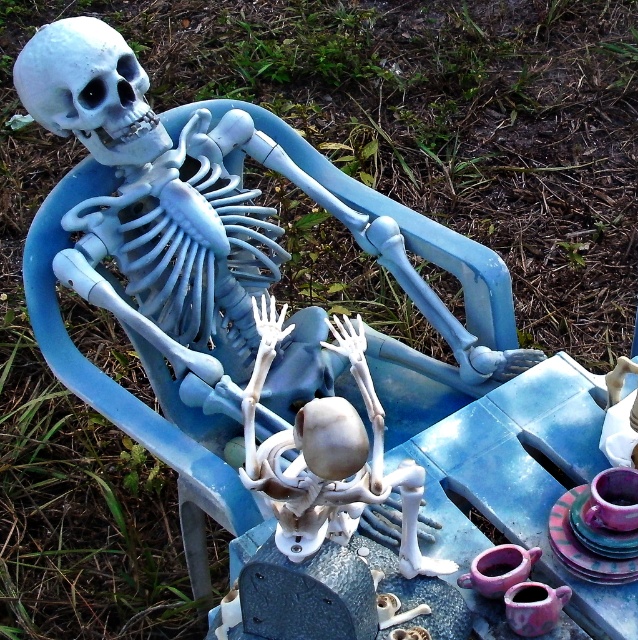
Question: Can you confirm if white matte skull at upper left is positioned below purple glazed cup at lower right?

Choices:
 (A) yes
 (B) no

Answer: (B)

Question: Which is farther from the purple glazed cup at lower right?

Choices:
 (A) white matte skeleton at center
 (B) white matte skull at upper left
 (C) matte purple cup at lower right

Answer: (B)

Question: Which object is closer to the camera taking this photo?

Choices:
 (A) white matte skeleton at center
 (B) matte purple cup at lower right
 (C) white matte skull at upper left

Answer: (A)

Question: Where is matte purple cup at lower right located in relation to purple glazed cup at lower right in the image?

Choices:
 (A) above
 (B) below

Answer: (A)

Question: Which point appears closest to the camera in this image?

Choices:
 (A) (144, 92)
 (B) (547, 588)
 (C) (399, 486)

Answer: (C)

Question: Can you confirm if white matte skeleton at center is thinner than white matte skull at upper left?

Choices:
 (A) yes
 (B) no

Answer: (B)